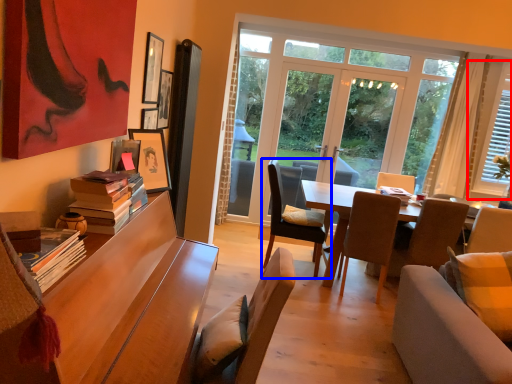
Question: Which object is closer to the camera taking this photo, window (highlighted by a red box) or chair (highlighted by a blue box)?

Choices:
 (A) window
 (B) chair

Answer: (B)